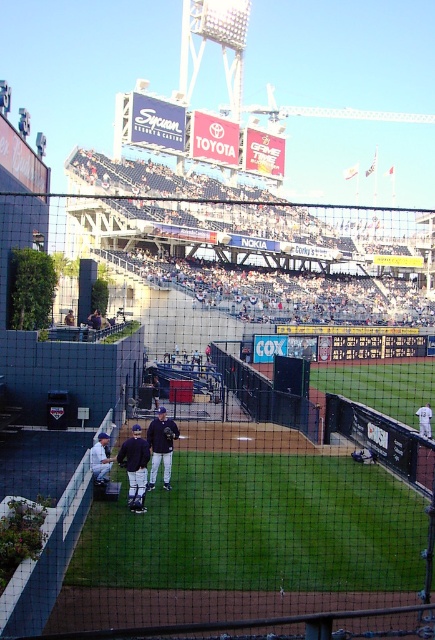
Question: Estimate the real-world distances between objects in this image. Which object is closer to the dark blue uniform at center?

Choices:
 (A) dark blue jersey at center
 (B) white uniformed players at center

Answer: (A)

Question: Which of the following is the farthest from the observer?

Choices:
 (A) (121, 481)
 (B) (163, 428)

Answer: (B)

Question: Which of the following is the closest to the observer?

Choices:
 (A) (129, 458)
 (B) (187, 182)
 (C) (424, 412)

Answer: (A)

Question: Is light blue jersey at center to the left of black leather baseball glove at center from the viewer's perspective?

Choices:
 (A) yes
 (B) no

Answer: (B)

Question: Can you confirm if white uniformed players at center is wider than white uniform at lower left?

Choices:
 (A) no
 (B) yes

Answer: (B)

Question: Is dark blue jersey at center further to camera compared to light blue jersey at center?

Choices:
 (A) no
 (B) yes

Answer: (A)